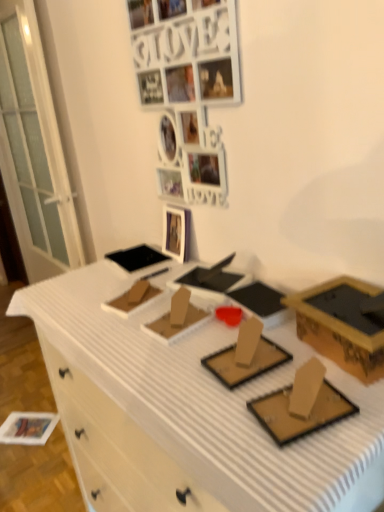
The image size is (384, 512). What are the coordinates of `free point above white matte drawer at lower left (from a real-world perspective)` in the screenshot? It's located at (34, 412).